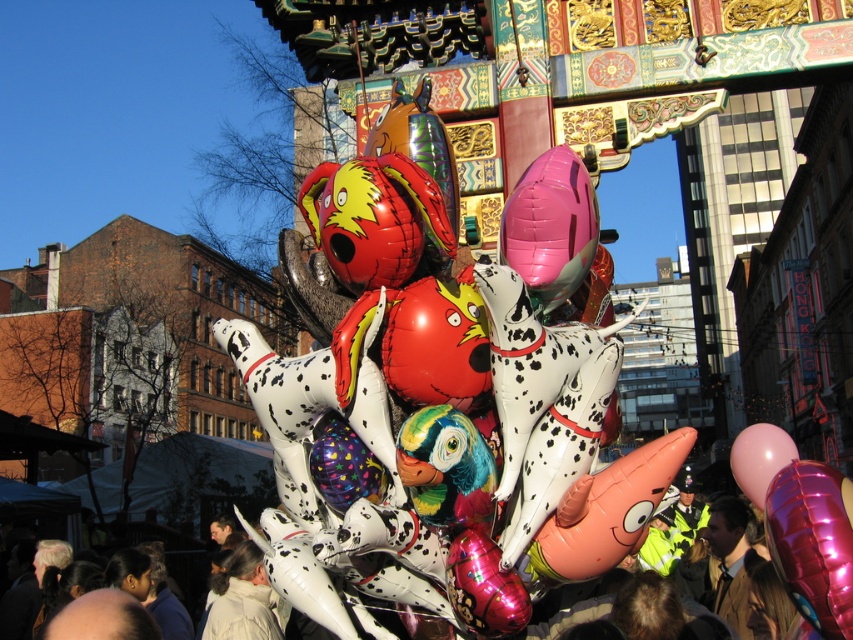
You are a photographer standing in the middle of the street, facing the festive balloon display. You notice two jackets in the scene. Which jacket, the light beige jacket at lower center or the brown leather jacket at lower right, is positioned closer to your left side?

The light beige jacket at lower center is positioned closer to your left side because it is to the left of the brown leather jacket at lower right.

You are a photographer trying to capture the festive balloons. You notice a glossy metallic balloon at center and a brown leather jacket at lower right. Which object is positioned to the left when viewed from your perspective?

The glossy metallic balloon at center is positioned to the left of the brown leather jacket at lower right.

You are a street performer who needs to move a 10 foot long ladder from the left side of the street to the right side. The ladder must pass between the glossy metallic balloon at center and the pink glossy balloon at right. Can the ladder fit through the space between them?

The distance between the glossy metallic balloon at center and the pink glossy balloon at right is 12.89 feet. Since the ladder is 10 feet long, it can easily fit through the space between them as the distance is greater than the ladder length.